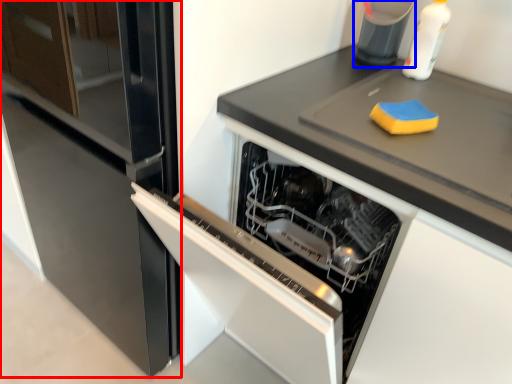
Question: Which of the following is the farthest to the observer, fridge (highlighted by a red box) or appliance (highlighted by a blue box)?

Choices:
 (A) fridge
 (B) appliance

Answer: (B)